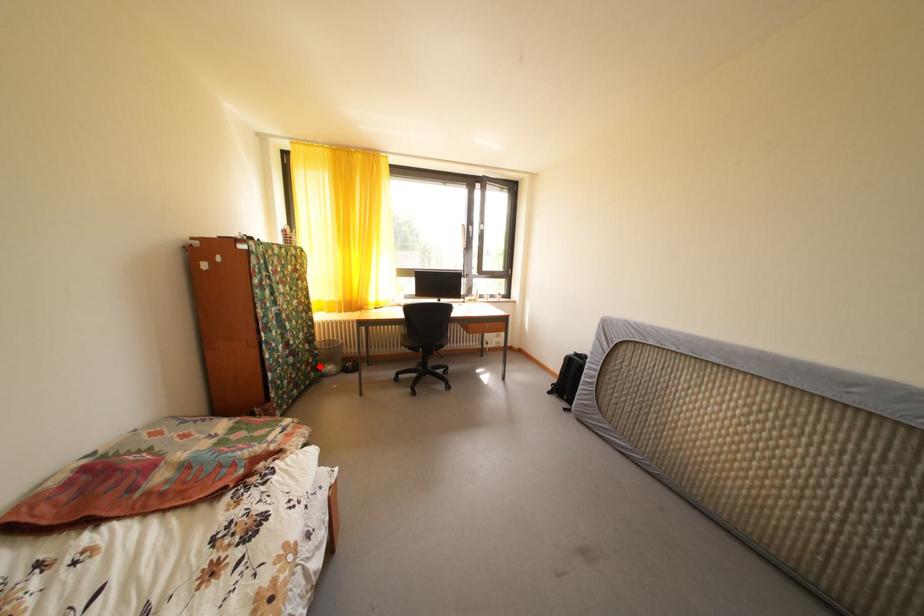
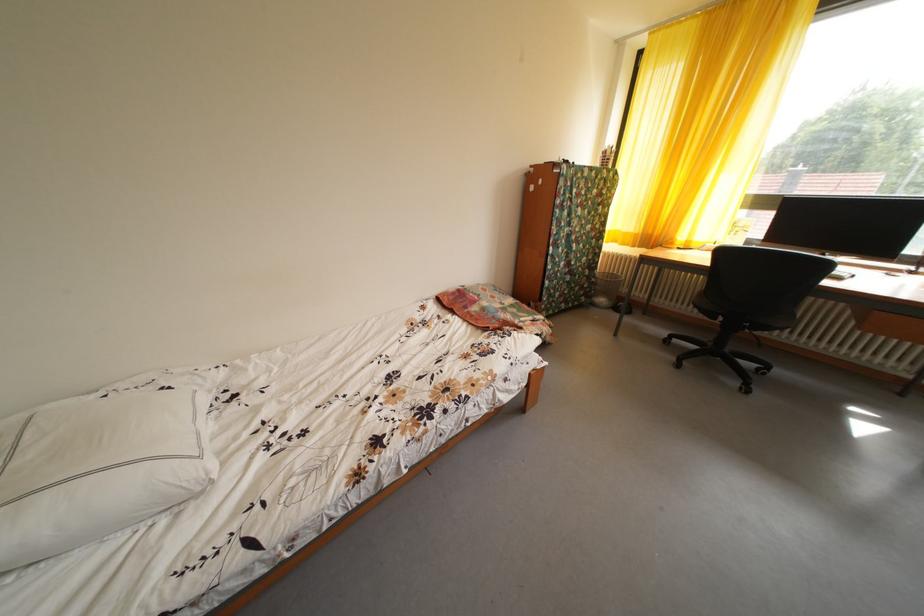
Question: A red point is marked in image1. In image2, is the corresponding 3D point closer to the camera or farther? Reply with the corresponding letter.

Choices:
 (A) The corresponding 3D point is closer.
 (B) The corresponding 3D point is farther.

Answer: (B)